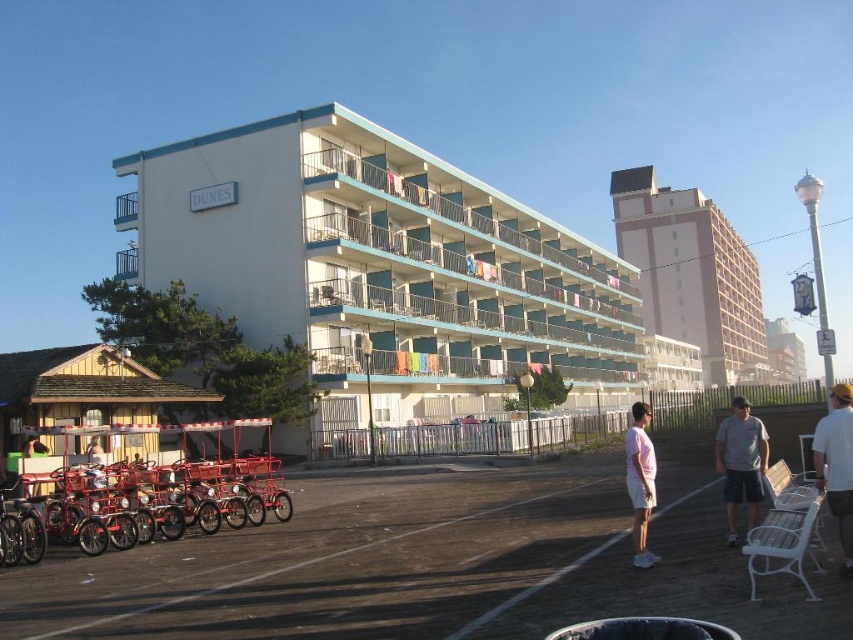
You are a tourist standing in front of the pink smooth building at upper center and want to rent a vehicle to explore the resort. Are the metallic red tricycles at lower left tall enough to allow you to sit comfortably on them?

The metallic red tricycles at lower left is shorter than pink smooth building at upper center. However, the height of the tricycles themselves would depend on their design. Since the question is about sitting comfort, which relates to the tricycle seat height, and the description only compares their height to the building, we cannot determine if they are tall enough for comfortable sitting based on the given information.